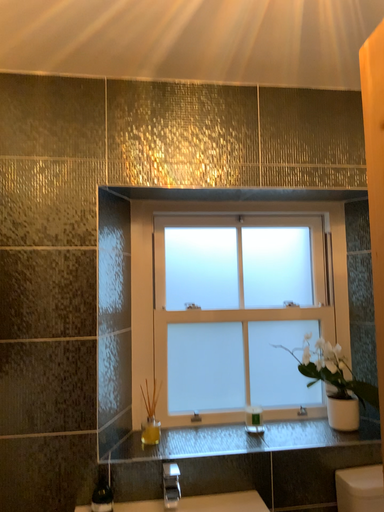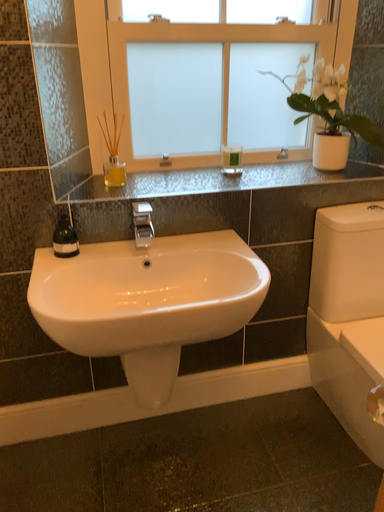
Question: How did the camera likely rotate when shooting the video?

Choices:
 (A) rotated upward
 (B) rotated downward

Answer: (B)